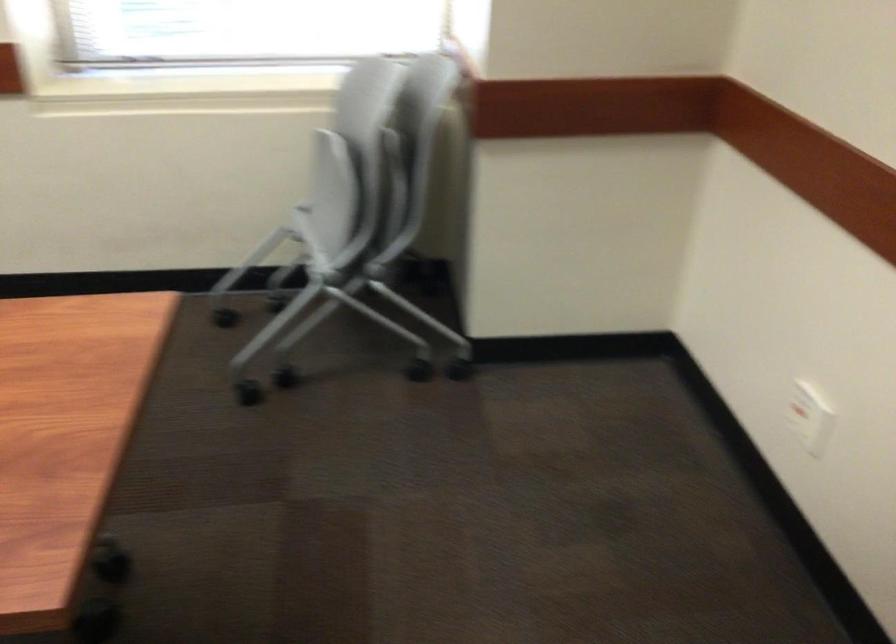
The width and height of the screenshot is (896, 644). What are the coordinates of `white wall switch` in the screenshot? It's located at (808, 415).